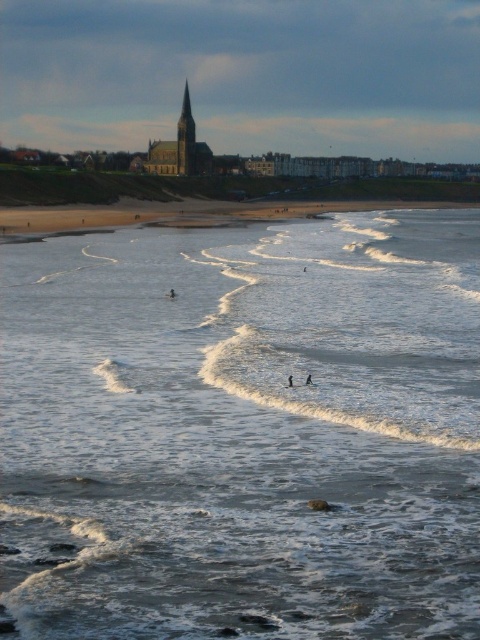
Consider the image. You are a photographer planning to capture the white foam surfboard at center and the clear water at lower center in a single shot. Based on their widths, which object should you position closer to the center of your frame to ensure both are adequately framed?

The clear water at lower center is wider than the white foam surfboard at center. Position the clear water at lower center closer to the center of your frame to ensure both objects are adequately framed.

From the picture: You are standing on the beach and see two points in the image. The first point is at coordinates point (446, 269) and the second is at point (298, 387). Which point is closer to you?

Point (446, 269) is further to the camera than point (298, 387), so the second point is closer to you.

You are a photographer planning to capture the white foam surfboard at center against the clear water at lower center. Considering the size difference mentioned, how might you frame the shot to emphasize the surfboard?

Since the clear water at lower center is larger than the white foam surfboard at center, you can frame the shot so the surfboard is positioned centrally against the expansive clear water to highlight its contrast in size and color.